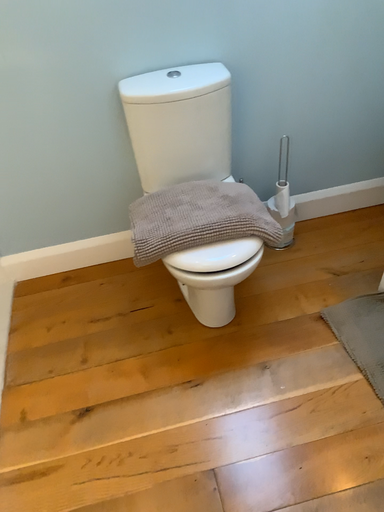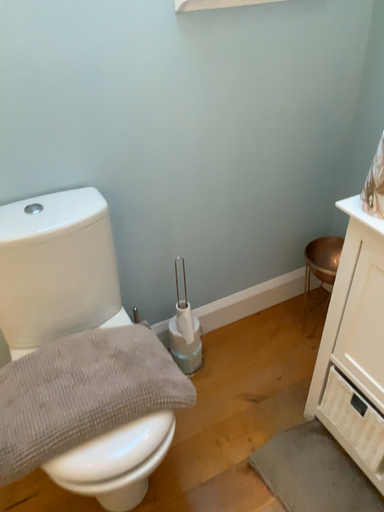
Question: Which way did the camera rotate in the video?

Choices:
 (A) rotated downward
 (B) rotated upward

Answer: (B)